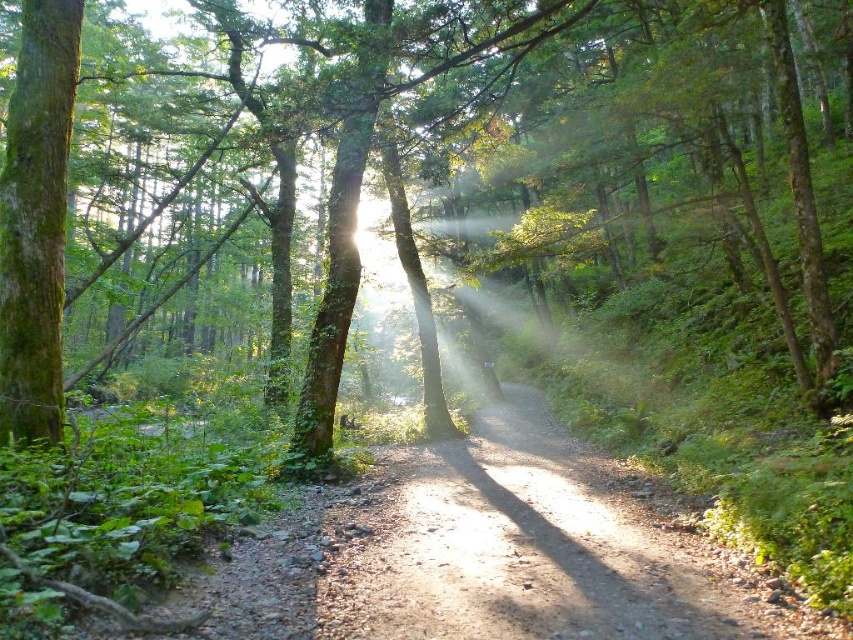
Does green mossy tree at center have a larger size compared to dirt path at center?

Indeed, green mossy tree at center has a larger size compared to dirt path at center.

Can you confirm if green mossy tree at center is positioned to the right of dirt path at center?

In fact, green mossy tree at center is to the left of dirt path at center.

Who is more distant from viewer, [683,4] or [532,444]?

Point [532,444]

Where is `green mossy tree at center`? The height and width of the screenshot is (640, 853). green mossy tree at center is located at coordinates (553, 154).